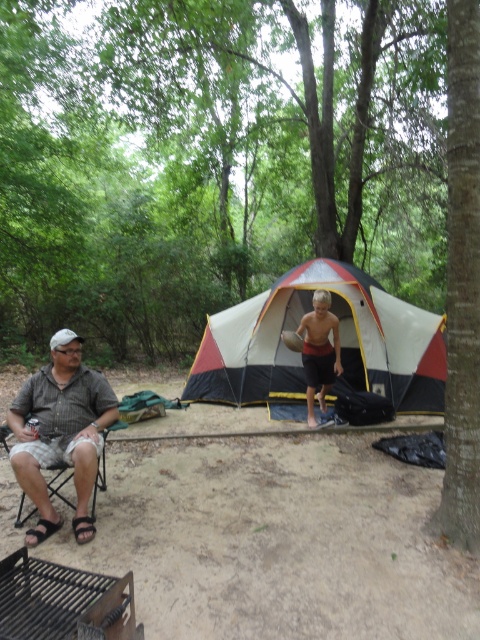
You are standing in the camping scene and want to move from the point at coordinates point (417,342) to the point at coordinates point (66,417). Which direction should you move in?

You should move downward and to the right because point (417,342) is further to the viewer than point (66,417), meaning it is closer to you. To reach the point at (66,417), you need to move away from your current position, which would involve moving downward and to the right in the frame.

What are the coordinates of the white canvas tent at center?

The white canvas tent at center is located at coordinates point (340,342).